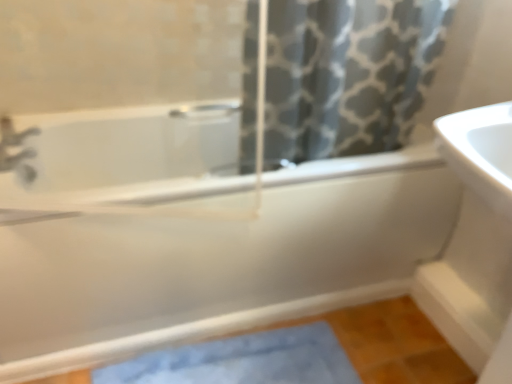
Question: Is blue fabric bath mat at lower center facing towards matte silver faucet at upper left?

Choices:
 (A) yes
 (B) no

Answer: (B)

Question: Is there a large distance between blue fabric bath mat at lower center and matte silver faucet at upper left?

Choices:
 (A) yes
 (B) no

Answer: (B)

Question: Is blue fabric bath mat at lower center taller than matte silver faucet at upper left?

Choices:
 (A) no
 (B) yes

Answer: (A)

Question: Is blue fabric bath mat at lower center thinner than matte silver faucet at upper left?

Choices:
 (A) yes
 (B) no

Answer: (B)

Question: Considering the relative sizes of blue fabric bath mat at lower center and matte silver faucet at upper left in the image provided, is blue fabric bath mat at lower center wider than matte silver faucet at upper left?

Choices:
 (A) yes
 (B) no

Answer: (A)

Question: Considering the positions of white glossy sink at right and gray printed fabric at upper center in the image, is white glossy sink at right bigger or smaller than gray printed fabric at upper center?

Choices:
 (A) big
 (B) small

Answer: (B)

Question: Is white glossy sink at right taller or shorter than gray printed fabric at upper center?

Choices:
 (A) tall
 (B) short

Answer: (B)

Question: Is point (459, 162) closer or farther from the camera than point (344, 11)?

Choices:
 (A) closer
 (B) farther

Answer: (A)

Question: From a real-world perspective, relative to gray printed fabric at upper center, is white glossy sink at right vertically above or below?

Choices:
 (A) above
 (B) below

Answer: (B)

Question: Is white glossy sink at right inside the boundaries of white glossy bathtub at center, or outside?

Choices:
 (A) outside
 (B) inside

Answer: (A)

Question: Is point (492, 294) positioned closer to the camera than point (174, 157)?

Choices:
 (A) closer
 (B) farther

Answer: (A)

Question: Is white glossy sink at right wider or thinner than white glossy bathtub at center?

Choices:
 (A) thin
 (B) wide

Answer: (A)

Question: In the image, is white glossy sink at right positioned in front of or behind white glossy bathtub at center?

Choices:
 (A) behind
 (B) front

Answer: (B)

Question: Looking at the image, does gray printed fabric at upper center seem bigger or smaller compared to matte silver faucet at upper left?

Choices:
 (A) big
 (B) small

Answer: (A)

Question: From the image's perspective, is gray printed fabric at upper center above or below matte silver faucet at upper left?

Choices:
 (A) below
 (B) above

Answer: (B)